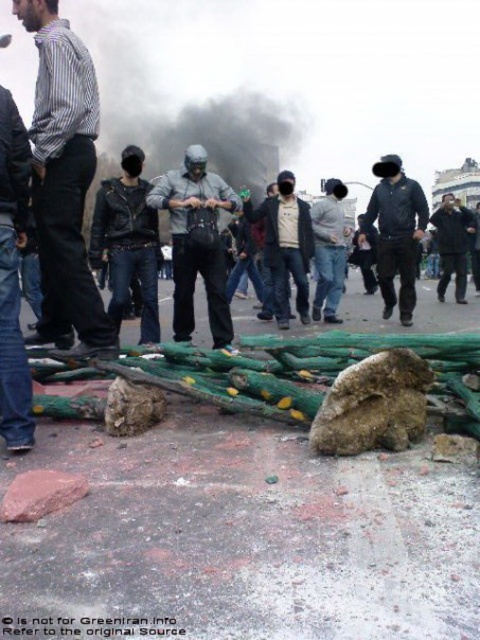
You are a photographer trying to capture a protest scene. You notice two individuals wearing a striped cotton shirt at left and a dark gray jacket at center. Based on their clothing height, which one would appear taller in your photo?

The striped cotton shirt at left appears taller in the photo since it has a greater height compared to the dark gray jacket at center according to the description.

You are a photographer trying to capture a clear shot of the gray matte helmet at center and the denim jeans at left. Since you want to focus on the helmet, which object should you adjust your camera lens to prioritize in terms of size in the frame?

The gray matte helmet at center has a lesser height compared to denim jeans at left. To prioritize the helmet, you should adjust your camera lens to make the gray matte helmet at center appear larger in the frame than the denim jeans at left.

You are a photographer trying to capture a clear image of the gray matte helmet at center. If your camera has a focus point at coordinates 0.380, 0.410, will it align with the helmet?

Yes, the gray matte helmet at center is exactly at point (196, 243), so the camera focus point will align with it perfectly.